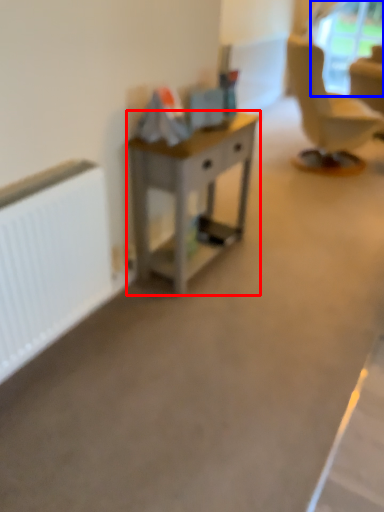
Question: Which object appears closest to the camera in this image, desk (highlighted by a red box) or window screen (highlighted by a blue box)?

Choices:
 (A) desk
 (B) window screen

Answer: (A)